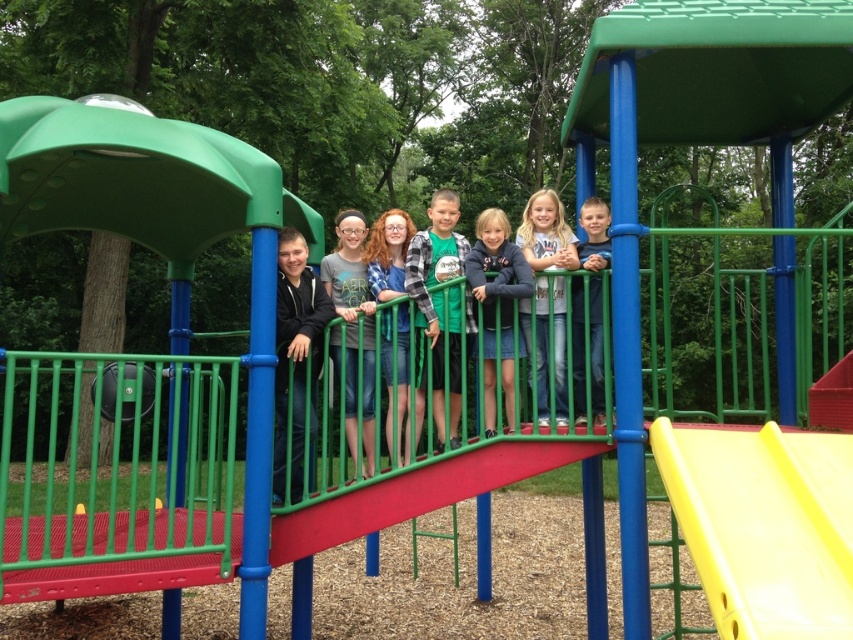
What do you see at coordinates (764, 525) in the screenshot? I see `yellow plastic slide at right` at bounding box center [764, 525].

Does point (723, 529) lie in front of point (432, 328)?

Yes, point (723, 529) is closer to viewer.

You are a GUI agent. You are given a task and a screenshot of the screen. Output one action in this format:
    pyautogui.click(x=<x>, y=<y>)
    Task: Click on the yellow plastic slide at right
    This screenshot has height=640, width=853.
    Given the screenshot: What is the action you would take?
    pyautogui.click(x=764, y=525)

Where is `yellow plastic slide at right`? yellow plastic slide at right is located at coordinates (764, 525).

Between yellow plastic slide at right and dark blue denim skirt at center, which one is positioned higher?

dark blue denim skirt at center is higher up.

Is point (735, 506) closer to camera compared to point (508, 314)?

Yes, point (735, 506) is in front of point (508, 314).

Image resolution: width=853 pixels, height=640 pixels. I want to click on yellow plastic slide at right, so click(764, 525).

Locate an element on the screen. The height and width of the screenshot is (640, 853). matte black hoodie at left is located at coordinates (296, 356).

Is point (289, 340) behind point (529, 316)?

No, it is not.

In order to click on matte black hoodie at left in this screenshot , I will do `click(296, 356)`.